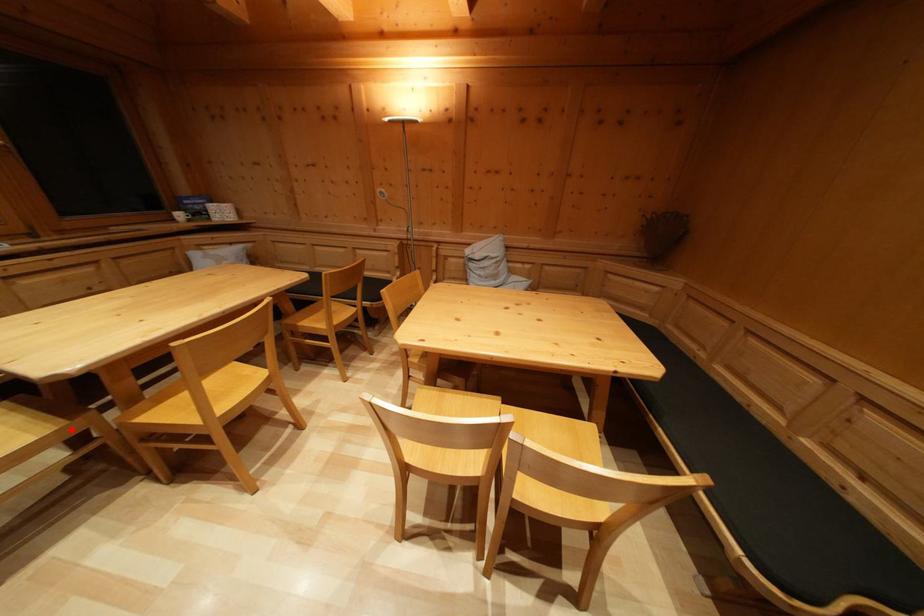
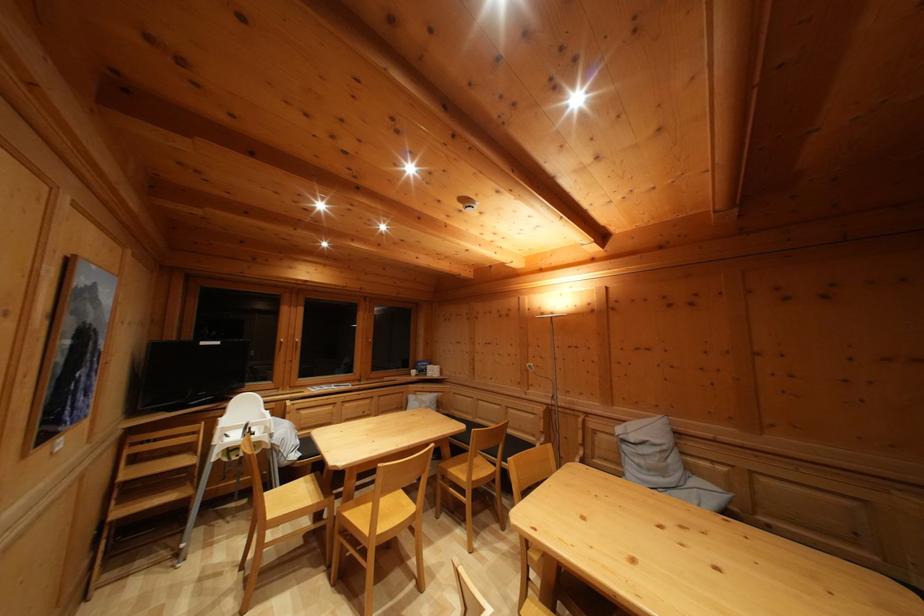
Locate, in the second image, the point that corresponds to the highlighted location in the first image.

(329, 506)